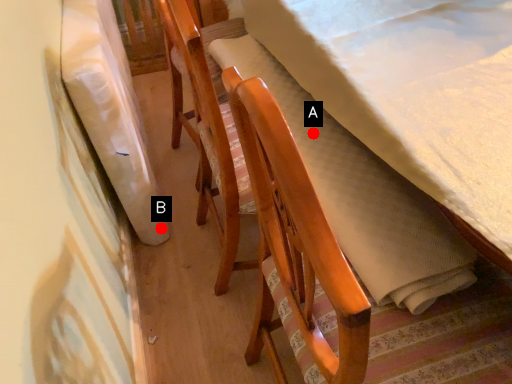
Question: Two points are circled on the image, labeled by A and B beside each circle. Which point is closer to the camera?

Choices:
 (A) A is closer
 (B) B is closer

Answer: (A)